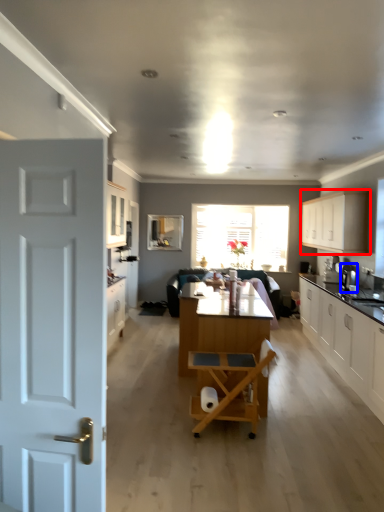
Question: Which point is further to the camera, cabinetry (highlighted by a red box) or coffee machine (highlighted by a blue box)?

Choices:
 (A) cabinetry
 (B) coffee machine

Answer: (A)